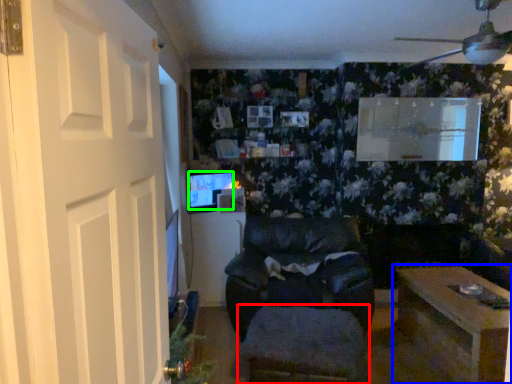
Question: Based on their relative distances, which object is nearer to footrest (highlighted by a red box)? Choose from table (highlighted by a blue box) and computer monitor (highlighted by a green box).

Choices:
 (A) table
 (B) computer monitor

Answer: (A)